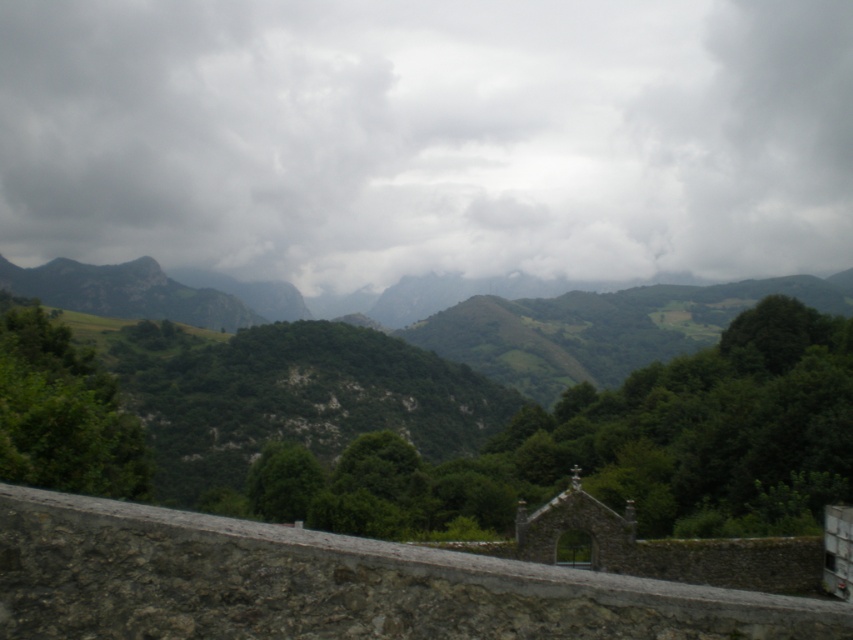
Question: Can you confirm if cloudy sky at upper center is positioned above gray stone wall at lower center?

Choices:
 (A) no
 (B) yes

Answer: (B)

Question: Is the position of cloudy sky at upper center less distant than that of gray stone wall at lower center?

Choices:
 (A) no
 (B) yes

Answer: (A)

Question: Which object appears farthest from the camera in this image?

Choices:
 (A) gray stone wall at lower center
 (B) cloudy sky at upper center

Answer: (B)

Question: Does cloudy sky at upper center appear under gray stone wall at lower center?

Choices:
 (A) no
 (B) yes

Answer: (A)

Question: Which object is closer to the camera taking this photo?

Choices:
 (A) gray stone wall at lower center
 (B) cloudy sky at upper center

Answer: (A)